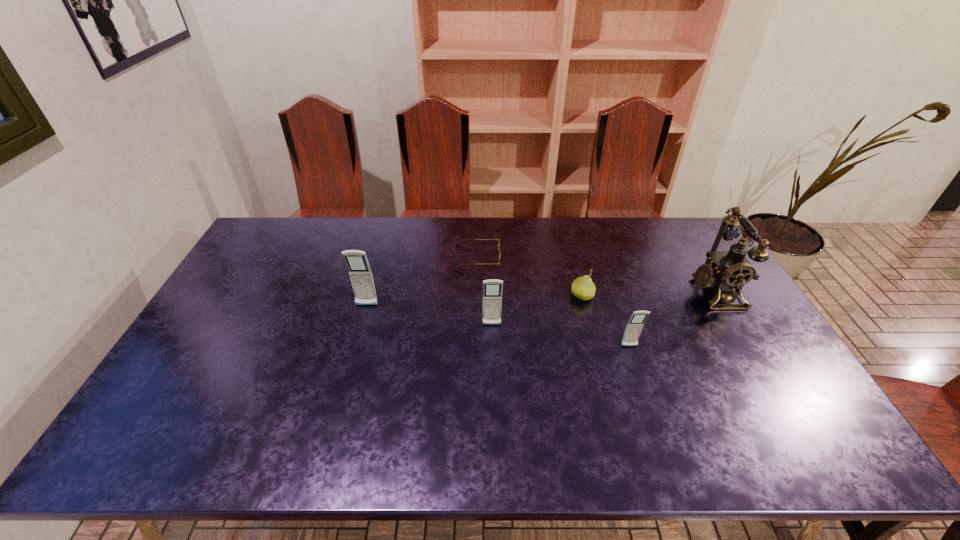
This screenshot has height=540, width=960. I want to click on the tallest object, so click(729, 270).

What are the coordinates of `free space located 0.180m on the front-facing side of the tallest cellular telephone` in the screenshot? It's located at (353, 355).

Locate an element on the screen. This screenshot has width=960, height=540. blank space located on the front-facing side of the second nearest object is located at coordinates (492, 344).

The width and height of the screenshot is (960, 540). I want to click on vacant space located 0.050m on the front-facing side of the nearest object, so click(635, 363).

Locate an element on the screen. The height and width of the screenshot is (540, 960). free space located 0.190m on the front-facing side of the sunglasses is located at coordinates (554, 257).

Locate an element on the screen. free space located on the back of the second shortest object is located at coordinates (565, 231).

What are the coordinates of `vacant area situated on the rotary dial of the rightmost object` in the screenshot? It's located at (594, 292).

This screenshot has height=540, width=960. What are the coordinates of `free region located on the rotary dial of the rightmost object` in the screenshot? It's located at pos(625,292).

What are the coordinates of `vacant area situated on the rotary dial of the rightmost object` in the screenshot? It's located at (615, 292).

Identify the location of object that is at the far edge. (499, 253).